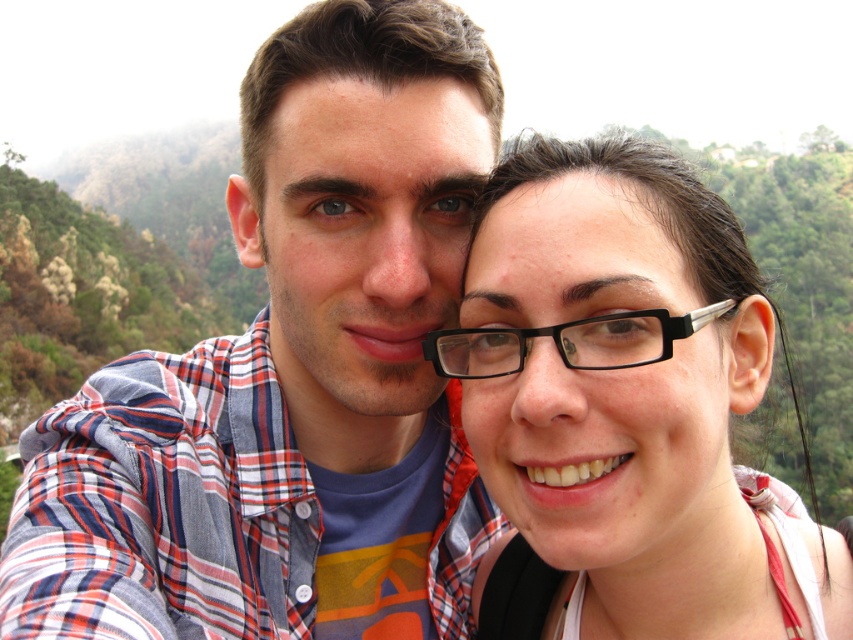
You are trying to determine the relative sizes of the objects in the image. Based on the scene, which object is taller between the plaid shirt at center and the clear plastic glasses at upper right?

The plaid shirt at center is much taller than the clear plastic glasses at upper right.

You are taking a photo of two people standing side by side. The person on the left is wearing a plaid shirt at center, and the person on the right is wearing black plastic glasses at center. From your perspective, which clothing item is positioned to the left?

The plaid shirt at center is positioned to the left of the black plastic glasses at center.